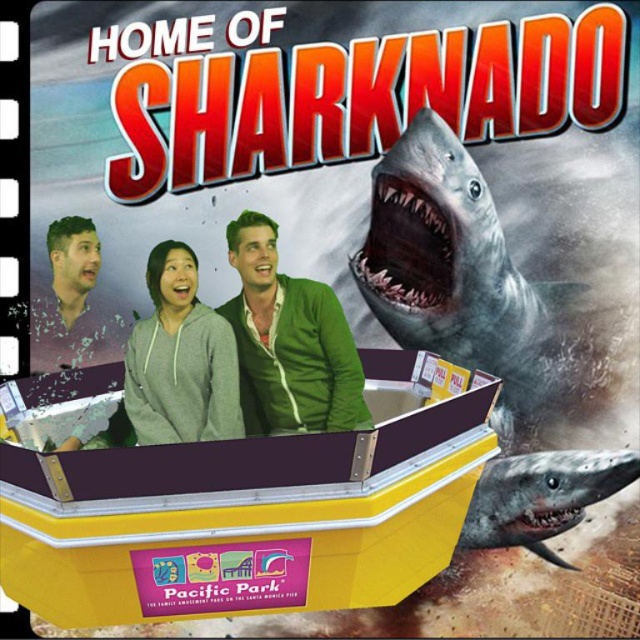
In order to click on gray textured shark at right in this screenshot , I will do `click(458, 275)`.

Is gray textured shark at right to the left of matte gray hoodie at center from the viewer's perspective?

No, gray textured shark at right is not to the left of matte gray hoodie at center.

What are the coordinates of `gray textured shark at right` in the screenshot? It's located at (458, 275).

Who is more forward, (262,259) or (84,307)?

Point (262,259) is in front.

In the scene shown: Is green cardigan at center below matte gray hoodie at center?

Yes.

You are a GUI agent. You are given a task and a screenshot of the screen. Output one action in this format:
    pyautogui.click(x=<x>, y=<y>)
    Task: Click on the green cardigan at center
    The height and width of the screenshot is (640, 640).
    Given the screenshot: What is the action you would take?
    pyautogui.click(x=289, y=340)

At what (x,y) coordinates should I click in order to perform the action: click on green cardigan at center. Please return your answer as a coordinate pair (x, y). Image resolution: width=640 pixels, height=640 pixels. Looking at the image, I should click on (289, 340).

Find the location of a particular element. The height and width of the screenshot is (640, 640). green cardigan at center is located at coordinates (289, 340).

Based on the photo, which is above, green cardigan at center or gray fleece sweatshirt at center?

green cardigan at center is above.

What do you see at coordinates (289, 340) in the screenshot? I see `green cardigan at center` at bounding box center [289, 340].

The image size is (640, 640). I want to click on green cardigan at center, so click(x=289, y=340).